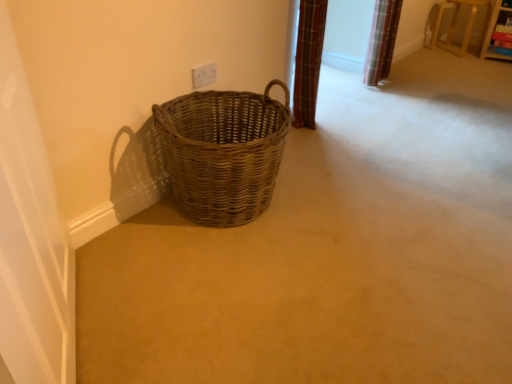
Find the location of `free point below white glossy screen door at left (from a real-world perspective)`. free point below white glossy screen door at left (from a real-world perspective) is located at coordinates (82, 322).